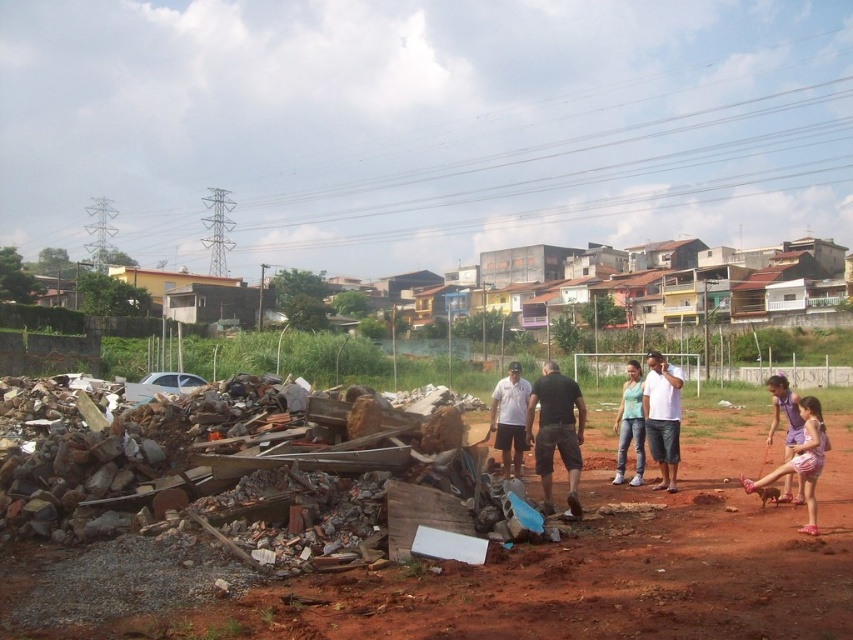
Question: Is pink fabric shorts at lower right smaller than purple fabric dress at lower right?

Choices:
 (A) no
 (B) yes

Answer: (B)

Question: Does black cotton shirt at center have a smaller size compared to white matte shirt at center?

Choices:
 (A) no
 (B) yes

Answer: (A)

Question: Among these objects, which one is farthest from the camera?

Choices:
 (A) purple fabric dress at lower right
 (B) pink fabric shorts at lower right
 (C) denim jeans at center
 (D) black cotton shirt at center

Answer: (C)

Question: Observing the image, what is the correct spatial positioning of black cotton shirt at center in reference to white cotton shirt at center?

Choices:
 (A) above
 (B) below

Answer: (B)

Question: Which point appears farthest from the camera in this image?

Choices:
 (A) (792, 433)
 (B) (523, 451)
 (C) (659, 429)
 (D) (538, 458)

Answer: (B)

Question: Which object is positioned closest to the purple fabric dress at lower right?

Choices:
 (A) denim jeans at center
 (B) white cotton shirt at center

Answer: (A)